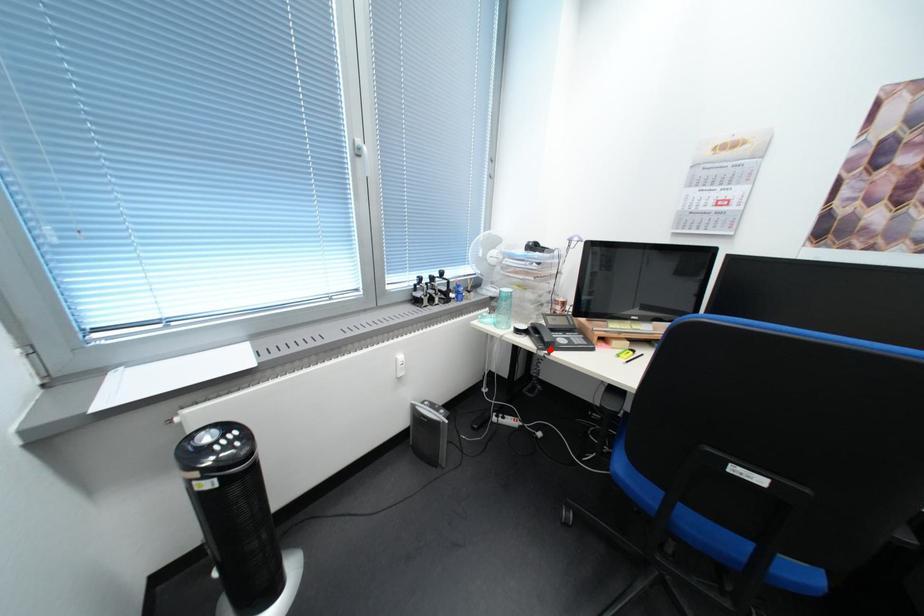
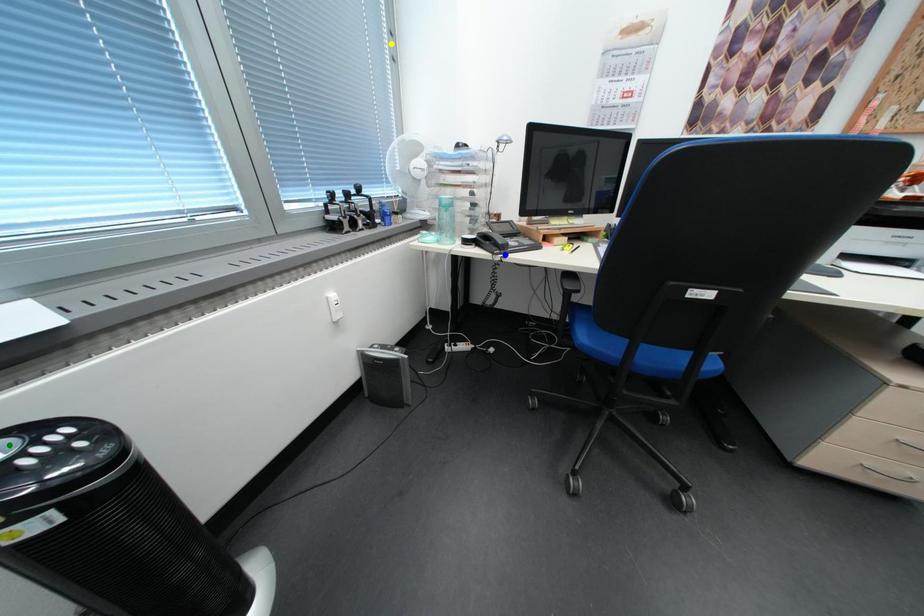
Question: I am providing you with two images of the same scene from different viewpoints. A red point is marked on the first image. You are given multiple points on the second image. Which point in image 2 represents the same 3d spot as the red point in image 1?

Choices:
 (A) blue point
 (B) green point
 (C) yellow point

Answer: (A)